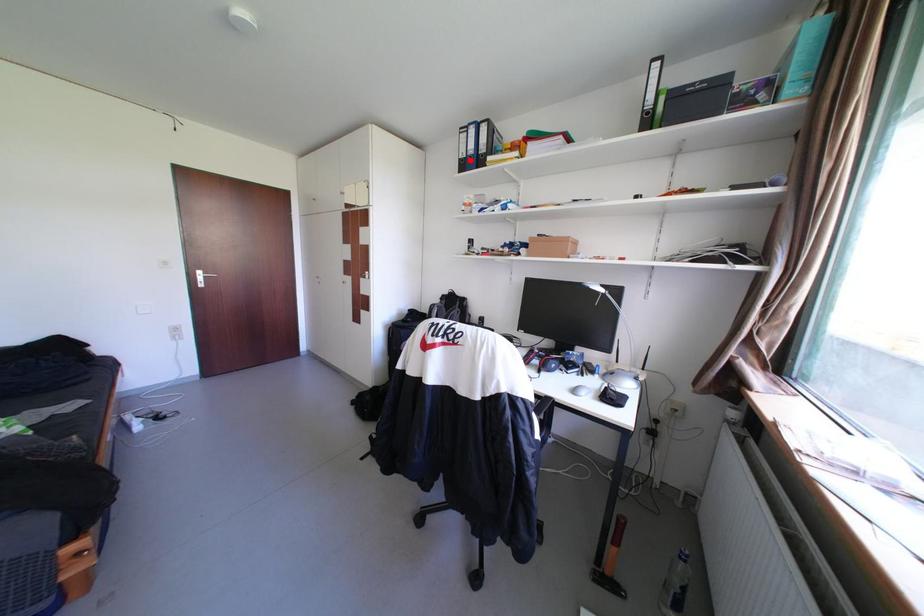
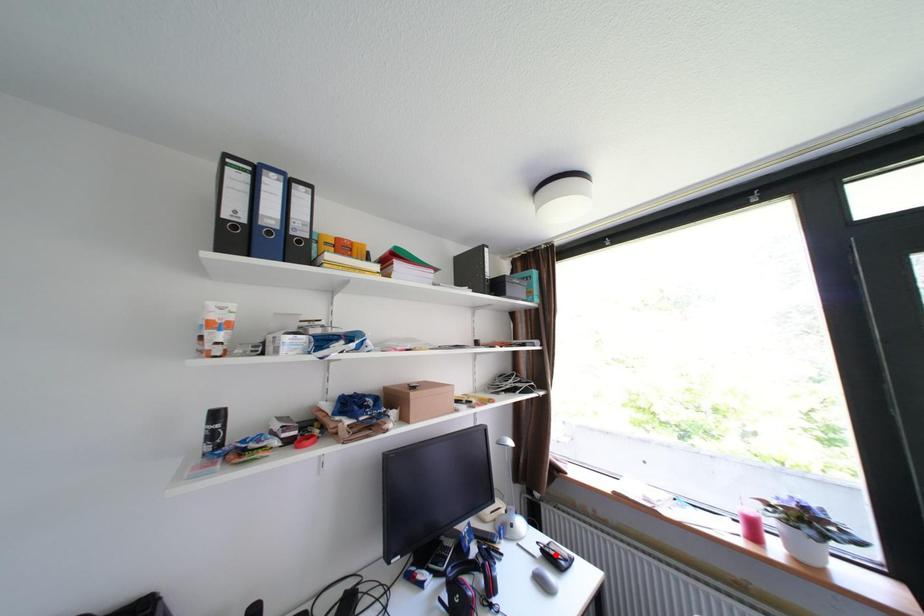
I am providing you with two images of the same scene from different viewpoints. A red point is marked on the first image and another point is marked on the second image. Does the point marked in image1 correspond to the same location as the one in image2?

No